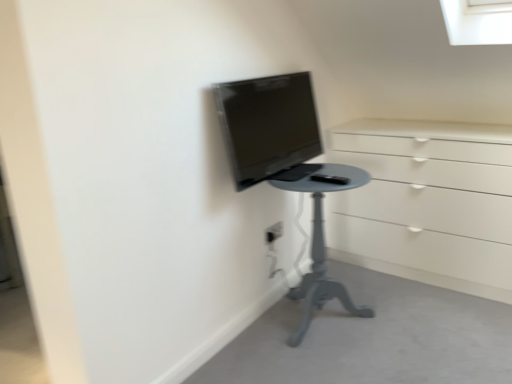
Question: From the image's perspective, does matte gray table at center appear higher than smooth gray table at lower center?

Choices:
 (A) yes
 (B) no

Answer: (A)

Question: Is matte gray table at center positioned far away from smooth gray table at lower center?

Choices:
 (A) no
 (B) yes

Answer: (A)

Question: Does matte gray table at center appear on the right side of smooth gray table at lower center?

Choices:
 (A) no
 (B) yes

Answer: (A)

Question: Can you confirm if matte gray table at center is shorter than smooth gray table at lower center?

Choices:
 (A) yes
 (B) no

Answer: (B)

Question: From the image's perspective, would you say matte gray table at center is shown under smooth gray table at lower center?

Choices:
 (A) no
 (B) yes

Answer: (A)

Question: In terms of size, does matte gray table at center appear bigger or smaller than smooth gray table at lower center?

Choices:
 (A) big
 (B) small

Answer: (A)

Question: Does point (295, 170) appear closer or farther from the camera than point (272, 375)?

Choices:
 (A) closer
 (B) farther

Answer: (B)

Question: From the image's perspective, is matte gray table at center above or below smooth gray table at lower center?

Choices:
 (A) above
 (B) below

Answer: (A)

Question: From a real-world perspective, is matte gray table at center above or below smooth gray table at lower center?

Choices:
 (A) above
 (B) below

Answer: (A)

Question: Which is correct: matte gray table at center is inside white plastic electric outlet at center, or outside of it?

Choices:
 (A) outside
 (B) inside

Answer: (A)

Question: In terms of height, does matte gray table at center look taller or shorter compared to white plastic electric outlet at center?

Choices:
 (A) tall
 (B) short

Answer: (A)

Question: Is point (311, 172) positioned closer to the camera than point (278, 235)?

Choices:
 (A) closer
 (B) farther

Answer: (A)

Question: From a real-world perspective, is matte gray table at center physically located above or below white plastic electric outlet at center?

Choices:
 (A) above
 (B) below

Answer: (B)

Question: Would you say smooth gray table at lower center is to the left or to the right of white plastic electric outlet at center in the picture?

Choices:
 (A) right
 (B) left

Answer: (A)

Question: From a real-world perspective, relative to white plastic electric outlet at center, is smooth gray table at lower center vertically above or below?

Choices:
 (A) below
 (B) above

Answer: (A)